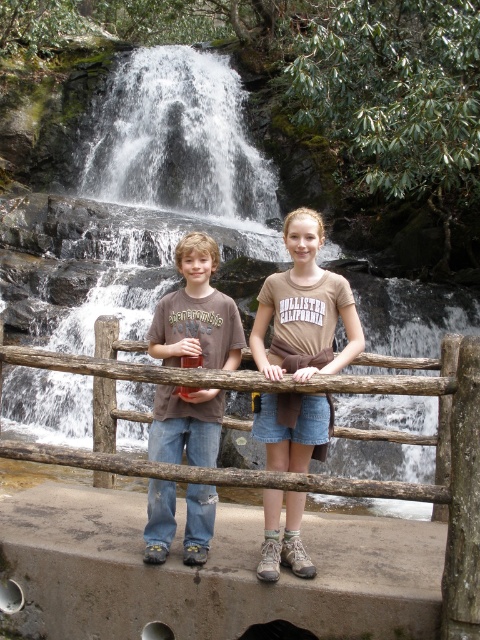
You are a photographer planning to take a photo of the brown wooden fence at center and the white frothy water at upper center. Based on their positions, which object should you focus on first to ensure both are in the frame?

The brown wooden fence at center is located below the white frothy water at upper center, so you should focus on the white frothy water at upper center first to ensure both are in the frame.